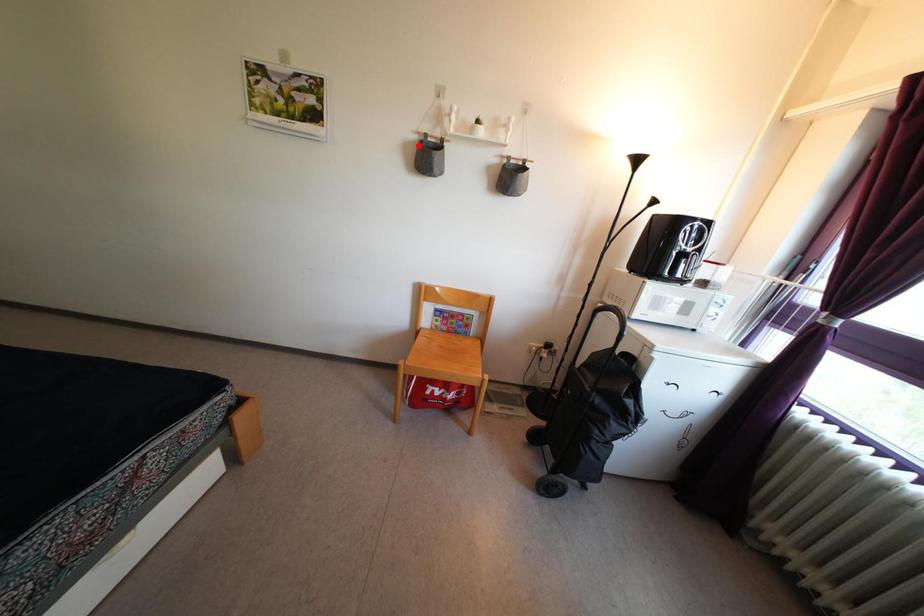
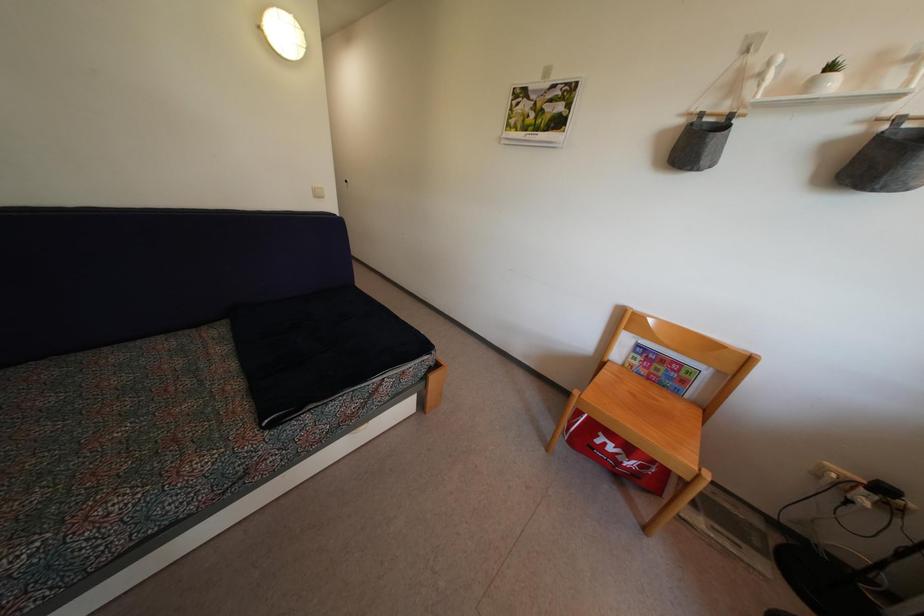
Locate, in the second image, the point that corresponds to the highlighted location in the first image.

(685, 129)